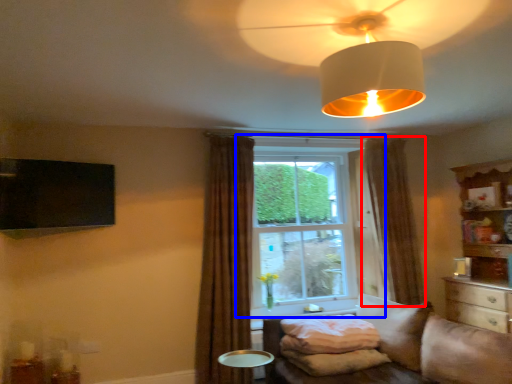
Question: Which point is closer to the camera, curtain (highlighted by a red box) or window (highlighted by a blue box)?

Choices:
 (A) curtain
 (B) window

Answer: (A)